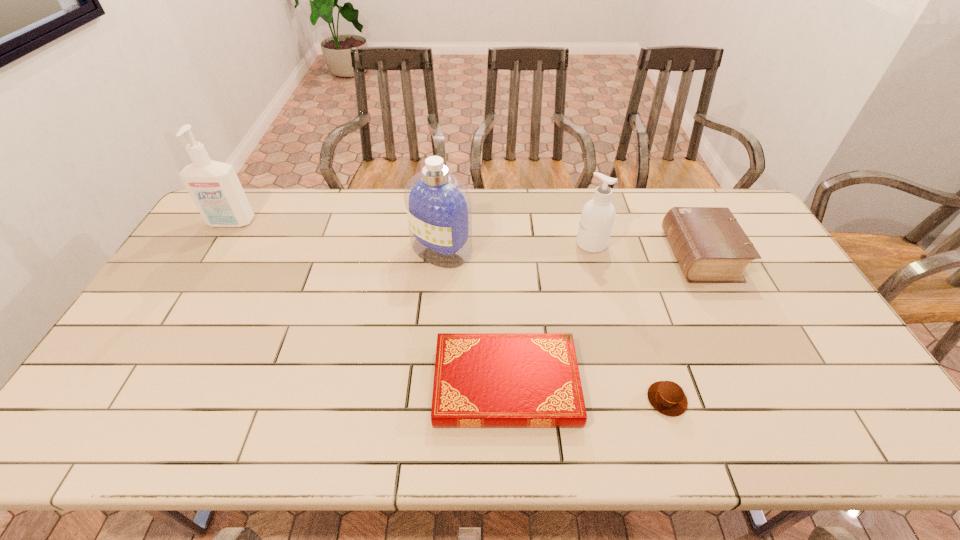
Identify the location of object that is the fifth closest to the rightmost cleansing agent. The height and width of the screenshot is (540, 960). (214, 186).

The width and height of the screenshot is (960, 540). What are the coordinates of `cleansing agent identified as the second closest to the second cleansing agent from right to left` in the screenshot? It's located at (214, 186).

Where is `cleansing agent that stands as the closest to the hardback book`? This screenshot has width=960, height=540. cleansing agent that stands as the closest to the hardback book is located at coordinates (438, 204).

At what (x,y) coordinates should I click in order to perform the action: click on vacant area that satisfies the following two spatial constraints: 1. on the front label of the leftmost object; 2. on the left side of the second cleansing agent from left to right. Please return your answer as a coordinate pair (x, y). The width and height of the screenshot is (960, 540). Looking at the image, I should click on (215, 249).

Where is `free space that satisfies the following two spatial constraints: 1. on the cover of the hardback book; 2. on the back side of the muffin`? free space that satisfies the following two spatial constraints: 1. on the cover of the hardback book; 2. on the back side of the muffin is located at coordinates (507, 400).

I want to click on vacant region that satisfies the following two spatial constraints: 1. on the spine side of the fourth tallest object; 2. on the front side of the muffin, so click(774, 400).

Locate an element on the screen. The width and height of the screenshot is (960, 540). vacant space that satisfies the following two spatial constraints: 1. on the front label of the muffin; 2. on the right side of the leftmost cleansing agent is located at coordinates (123, 400).

Identify the location of vacant space that satisfies the following two spatial constraints: 1. on the cover of the hardback book; 2. on the right side of the muffin. This screenshot has width=960, height=540. (507, 400).